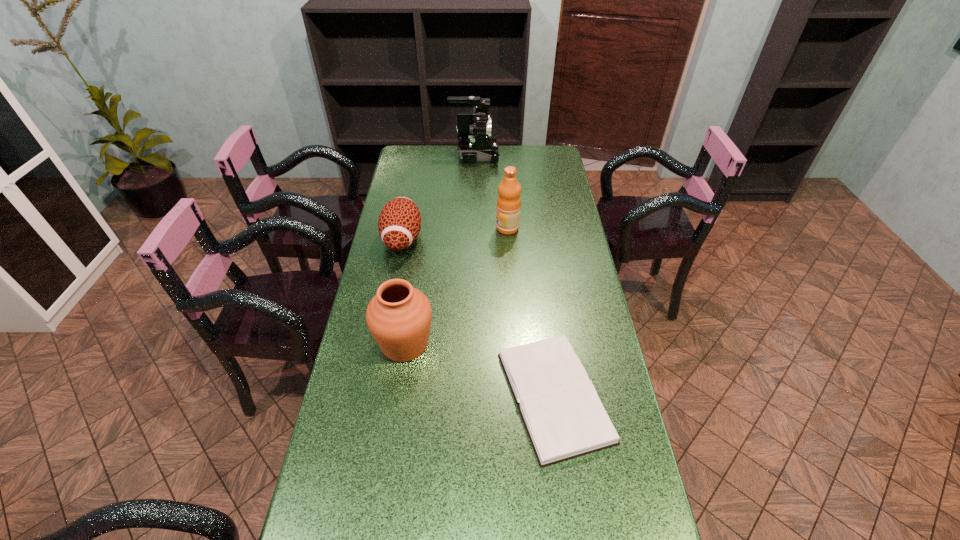
Locate an element on the screen. The image size is (960, 540). free space between the hardback book and the fruit juice is located at coordinates (531, 312).

At what (x,y) coordinates should I click in order to perform the action: click on free space between the urn and the shortest object. Please return your answer as a coordinate pair (x, y). Looking at the image, I should click on (479, 370).

Identify the location of vacant region between the football and the farthest object. This screenshot has height=540, width=960. (439, 197).

Find the location of a particular element. free space between the urn and the shortest object is located at coordinates (479, 370).

Locate an element on the screen. vacant area between the urn and the camcorder is located at coordinates (440, 249).

Where is `empty space between the fourth tallest object and the fruit juice`? This screenshot has height=540, width=960. empty space between the fourth tallest object and the fruit juice is located at coordinates (455, 234).

Where is `object that is the third closest to the shortest object`? This screenshot has height=540, width=960. object that is the third closest to the shortest object is located at coordinates (508, 202).

Locate an element on the screen. This screenshot has width=960, height=540. object that is the closest to the fruit juice is located at coordinates (399, 224).

Locate an element on the screen. This screenshot has width=960, height=540. free region that satisfies the following two spatial constraints: 1. on the lens mount of the hardback book; 2. on the right side of the camcorder is located at coordinates (470, 396).

Find the location of a particular element. vacant space that satisfies the following two spatial constraints: 1. on the lens mount of the hardback book; 2. on the right side of the farthest object is located at coordinates (470, 396).